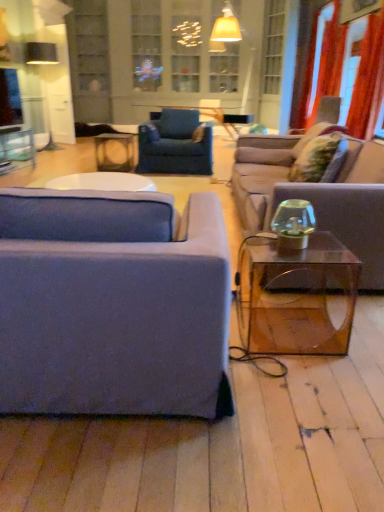
Question: Is transparent glass window screen at upper left aimed at clear glass cabinet at upper center?

Choices:
 (A) yes
 (B) no

Answer: (B)

Question: Are transparent glass window screen at upper left and clear glass cabinet at upper center far apart?

Choices:
 (A) no
 (B) yes

Answer: (B)

Question: Is transparent glass window screen at upper left completely or partially outside of clear glass cabinet at upper center?

Choices:
 (A) no
 (B) yes

Answer: (B)

Question: Is transparent glass window screen at upper left thinner than clear glass cabinet at upper center?

Choices:
 (A) no
 (B) yes

Answer: (B)

Question: Is clear glass cabinet at upper center a part of transparent glass window screen at upper left?

Choices:
 (A) yes
 (B) no

Answer: (B)

Question: In terms of width, does red velvet curtain at upper right, acting as the first curtain starting from the back, look wider or thinner when compared to black fabric lampshade at upper left?

Choices:
 (A) wide
 (B) thin

Answer: (B)

Question: From a real-world perspective, is red velvet curtain at upper right, marked as the second curtain in a front-to-back arrangement, positioned above or below black fabric lampshade at upper left?

Choices:
 (A) below
 (B) above

Answer: (B)

Question: In the image, is red velvet curtain at upper right, acting as the first curtain starting from the back, on the left side or the right side of black fabric lampshade at upper left?

Choices:
 (A) right
 (B) left

Answer: (A)

Question: In the image, is red velvet curtain at upper right, acting as the first curtain starting from the back, positioned in front of or behind black fabric lampshade at upper left?

Choices:
 (A) front
 (B) behind

Answer: (B)

Question: From their relative heights in the image, would you say black fabric lampshade at upper left is taller or shorter than orange fabric curtain at upper right, marked as the first curtain in a front-to-back arrangement?

Choices:
 (A) short
 (B) tall

Answer: (A)

Question: From the image's perspective, relative to orange fabric curtain at upper right, arranged as the second curtain when viewed from the back, is black fabric lampshade at upper left above or below?

Choices:
 (A) above
 (B) below

Answer: (A)

Question: From a real-world perspective, is black fabric lampshade at upper left physically located above or below orange fabric curtain at upper right, marked as the first curtain in a front-to-back arrangement?

Choices:
 (A) below
 (B) above

Answer: (A)

Question: Visually, is black fabric lampshade at upper left positioned to the left or to the right of orange fabric curtain at upper right, arranged as the second curtain when viewed from the back?

Choices:
 (A) right
 (B) left

Answer: (B)

Question: Is matte blue fabric couch at left, placed as the first studio couch when sorted from front to back, spatially inside velvet blue armchair at center, or outside of it?

Choices:
 (A) outside
 (B) inside

Answer: (A)

Question: Looking at the image, does matte blue fabric couch at left, placed as the first studio couch when sorted from front to back, seem bigger or smaller compared to velvet blue armchair at center?

Choices:
 (A) small
 (B) big

Answer: (B)